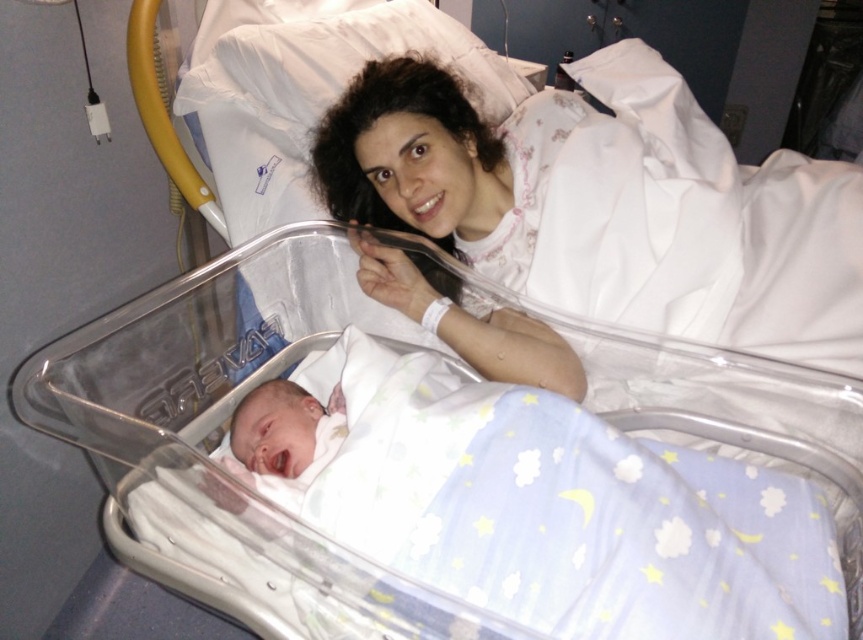
You are a nurse in a hospital room. You need to place a new medical chart on the desk. The desk is located at point (609, 204). Where should you place the chart?

The white satin gown at upper center is located at point (609, 204), so you should place the chart on the desk at that location.

You are a nurse in the hospital room and need to reach the soft white swaddle at center to check on the baby. However, the white satin gown at upper center is in the way. Can you easily access the swaddle without moving the gown?

The soft white swaddle at center is behind the white satin gown at upper center, so you would need to move the gown to access the swaddle.

You are a nurse checking the hospital room layout. You need to place a new medical chart on the bed that requires 10 cm of vertical space. The white satin gown at upper center and the soft white swaddle at center are in the way. Which object must you move to make space?

The white satin gown at upper center is taller than the soft white swaddle at center, so you must move the white satin gown at upper center to free up the required vertical space.